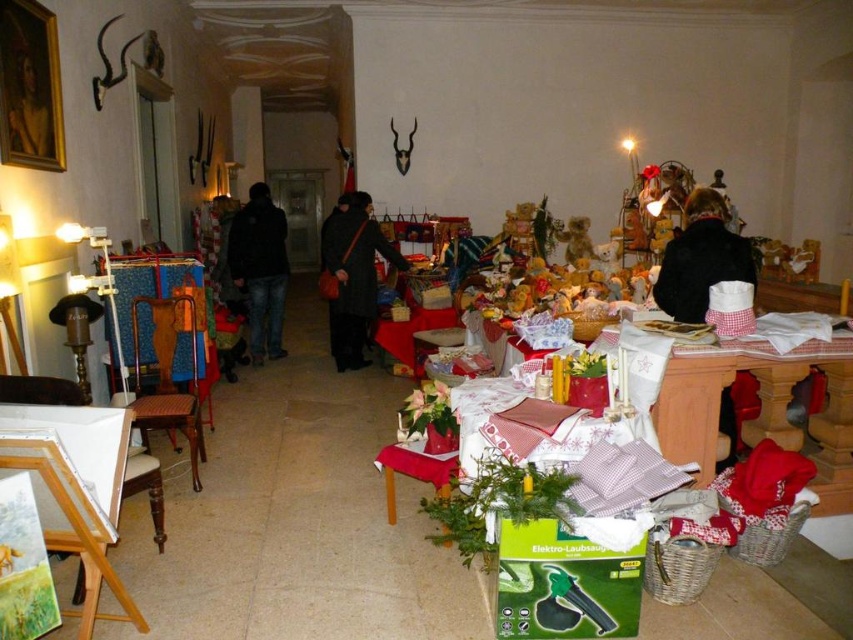
Who is lower down, red checkered tablecloth at lower right or dark wool coat at center?

red checkered tablecloth at lower right is below.

Measure the distance between point (660, 387) and camera.

Point (660, 387) and camera are 9.52 feet apart from each other.

Where is `red checkered tablecloth at lower right`? The width and height of the screenshot is (853, 640). red checkered tablecloth at lower right is located at coordinates (759, 406).

Who is taller, red checkered tablecloth at lower right or dark blue jeans at center?

Standing taller between the two is dark blue jeans at center.

Between red checkered tablecloth at lower right and dark blue jeans at center, which one appears on the left side from the viewer's perspective?

From the viewer's perspective, dark blue jeans at center appears more on the left side.

Who is more forward, (686, 346) or (259, 321)?

Point (686, 346) is more forward.

Locate an element on the screen. red checkered tablecloth at lower right is located at coordinates (759, 406).

Is dark wool coat at center above dark blue jeans at center?

Correct, dark wool coat at center is located above dark blue jeans at center.

Between dark wool coat at center and dark blue jeans at center, which one has more height?

dark blue jeans at center

This screenshot has height=640, width=853. What do you see at coordinates (354, 276) in the screenshot?
I see `dark wool coat at center` at bounding box center [354, 276].

Identify the location of dark wool coat at center. This screenshot has height=640, width=853. (354, 276).